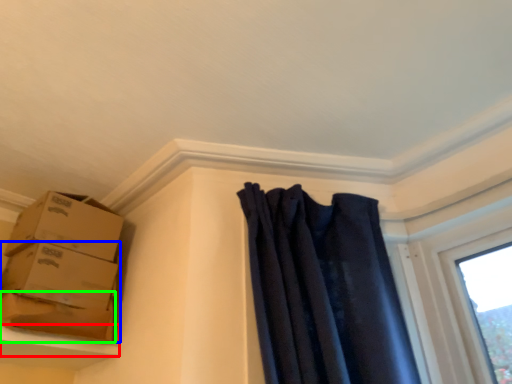
Question: Which object is positioned farthest from window sill (highlighted by a red box)? Select from box (highlighted by a blue box) and cardboard box (highlighted by a green box).

Choices:
 (A) box
 (B) cardboard box

Answer: (A)